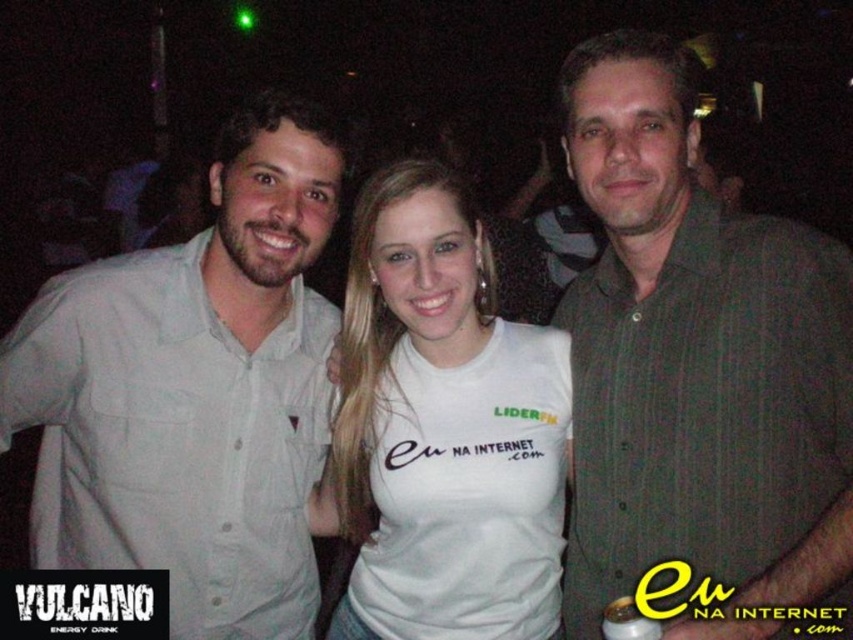
You are standing at the origin point of the coordinate system in this image. You want to move towards the point labeled as point (633, 90) and the point labeled as point (331, 472). Which point will you reach first?

Since point (633, 90) is in front of point (331, 472), you will reach point (633, 90) first.